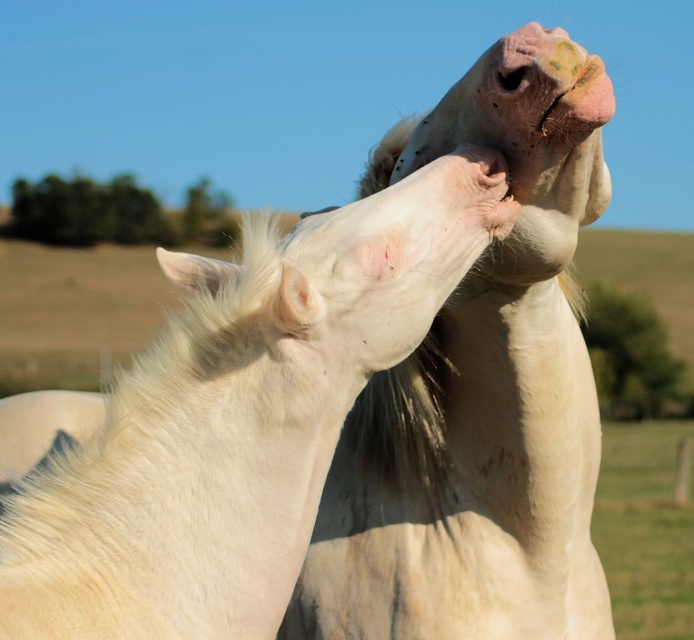
In the scene shown: Which is more to the right, white matte horse at upper center or white matte horse at center?

Positioned to the right is white matte horse at center.

Describe the element at coordinates (230, 429) in the screenshot. I see `white matte horse at upper center` at that location.

The height and width of the screenshot is (640, 694). What are the coordinates of `white matte horse at upper center` in the screenshot? It's located at (230, 429).

Who is more distant from viewer, [369,392] or [502,161]?

Positioned behind is point [369,392].

Describe the element at coordinates (480, 392) in the screenshot. I see `white matte horse at center` at that location.

The height and width of the screenshot is (640, 694). In order to click on white matte horse at center in this screenshot , I will do `click(480, 392)`.

Who is positioned more to the right, white matte horse at upper center or white soft fur at center?

From the viewer's perspective, white soft fur at center appears more on the right side.

At what (x,y) coordinates should I click in order to perform the action: click on white matte horse at upper center. Please return your answer as a coordinate pair (x, y). Looking at the image, I should click on (230, 429).

You are a GUI agent. You are given a task and a screenshot of the screen. Output one action in this format:
    pyautogui.click(x=<x>, y=<y>)
    Task: Click on the white matte horse at upper center
    Image resolution: width=694 pixels, height=640 pixels.
    Given the screenshot: What is the action you would take?
    pyautogui.click(x=230, y=429)